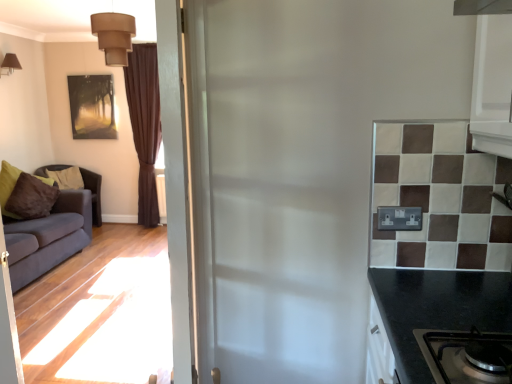
Question: Which is correct: matte brown wall light at upper left, the 1th lamp from the back, is inside matte gold picture frame at upper left, or outside of it?

Choices:
 (A) outside
 (B) inside

Answer: (A)

Question: From a real-world perspective, is matte brown wall light at upper left, the 1th lamp in the left-to-right sequence, above or below matte gold picture frame at upper left?

Choices:
 (A) below
 (B) above

Answer: (B)

Question: Estimate the real-world distances between objects in this image. Which object is closer to the matte brown lampshade at upper left, which is the 1th lamp from right to left?

Choices:
 (A) matte brown fabric couch at left, the second studio couch when ordered from front to back
 (B) white glossy door at center
 (C) velvet blue couch at left, marked as the second studio couch in a back-to-front arrangement
 (D) matte brown wall light at upper left, the 1th lamp in the left-to-right sequence
 (E) brown velvet curtain at left

Answer: (E)

Question: Based on their relative distances, which object is nearer to the matte brown lampshade at upper left, which ranks as the 2th lamp in left-to-right order?

Choices:
 (A) white glossy door at center
 (B) velvet blue couch at left, marked as the second studio couch in a back-to-front arrangement
 (C) matte brown fabric couch at left, placed as the first studio couch when sorted from back to front
 (D) matte brown wall light at upper left, positioned as the second lamp in front-to-back order
 (E) matte gold picture frame at upper left

Answer: (B)